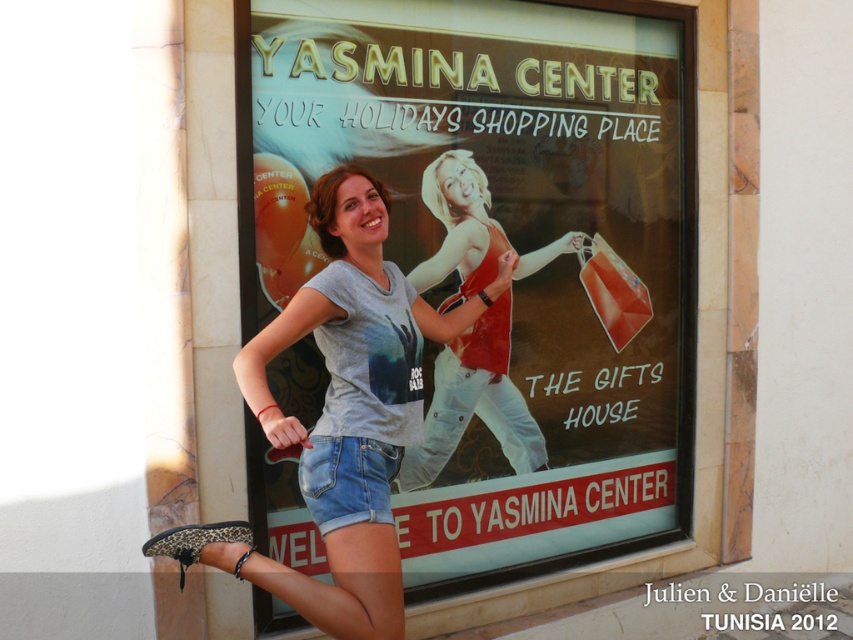
You are a photographer setting up a shoot in the scene described. You need to ensure that the matte plastic signboard at center is visible above the matte red tank top at center in your photo. Based on their sizes, is this possible?

The matte plastic signboard at center is much taller than the matte red tank top at center, so yes, it can be positioned to be visible above it in the photo.